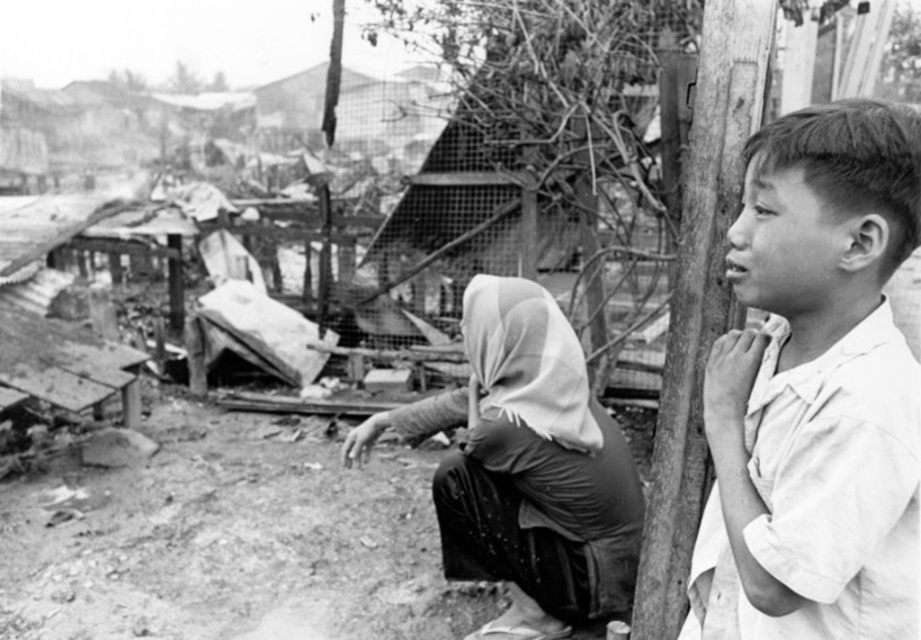
Question: Which point is closer to the camera taking this photo?

Choices:
 (A) (721, 150)
 (B) (542, 358)
 (C) (885, 106)

Answer: (C)

Question: Is white fabric headscarf at center below smooth wood pole at right?

Choices:
 (A) yes
 (B) no

Answer: (A)

Question: Among these points, which one is nearest to the camera?

Choices:
 (A) (811, 612)
 (B) (709, 237)
 (C) (462, 516)

Answer: (A)

Question: Is white fabric headscarf at center above smooth wood pole at right?

Choices:
 (A) yes
 (B) no

Answer: (B)

Question: Which of the following is the farthest from the observer?

Choices:
 (A) white cotton shirt at right
 (B) white fabric headscarf at center

Answer: (B)

Question: Is white cotton shirt at right thinner than smooth wood pole at right?

Choices:
 (A) no
 (B) yes

Answer: (A)